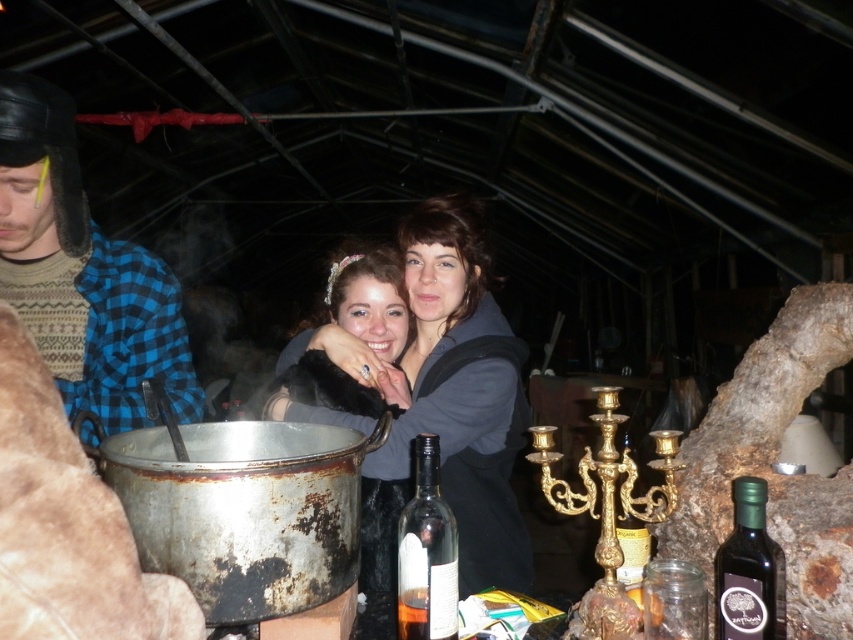
Question: Does dark gray hoodie at center come behind blue plaid shirt at left?

Choices:
 (A) no
 (B) yes

Answer: (A)

Question: Which is nearer to the translucent glass bottle at center-right?

Choices:
 (A) blue plaid shirt at left
 (B) green glass bottle at right
 (C) dark gray hoodie at center
 (D) clear glass bottle at lower center

Answer: (B)

Question: Is matte black fur coat at center bigger than translucent glass bottle at center-right?

Choices:
 (A) yes
 (B) no

Answer: (A)

Question: Which point appears closest to the camera in this image?

Choices:
 (A) (639, 554)
 (B) (38, 211)
 (C) (415, 566)
 (D) (734, 634)

Answer: (D)

Question: Is dark gray hoodie at center closer to camera compared to blue plaid shirt at left?

Choices:
 (A) no
 (B) yes

Answer: (B)

Question: Based on their relative distances, which object is nearer to the matte black fur coat at center?

Choices:
 (A) translucent glass bottle at center-right
 (B) dark gray hoodie at center

Answer: (B)